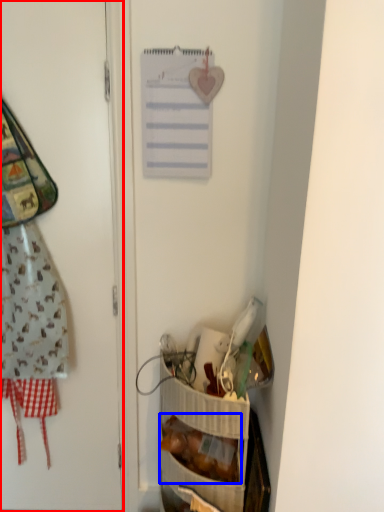
Question: Which object appears closest to the camera in this image, door (highlighted by a red box) or food (highlighted by a blue box)?

Choices:
 (A) door
 (B) food

Answer: (A)